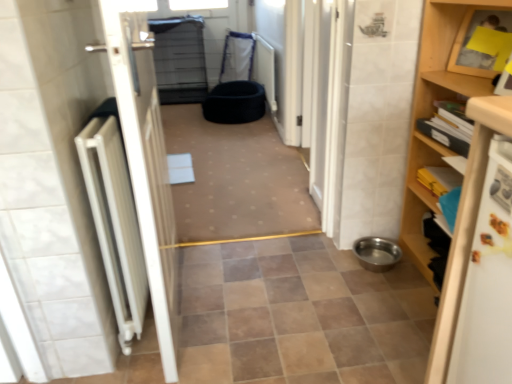
Image resolution: width=512 pixels, height=384 pixels. I want to click on free space above black fabric pet bed at center (from a real-world perspective), so click(227, 160).